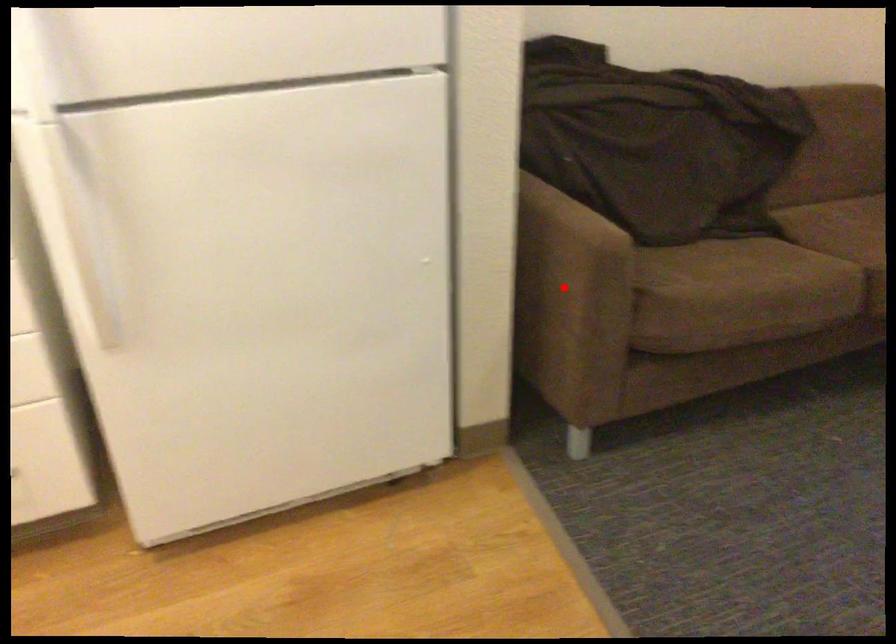
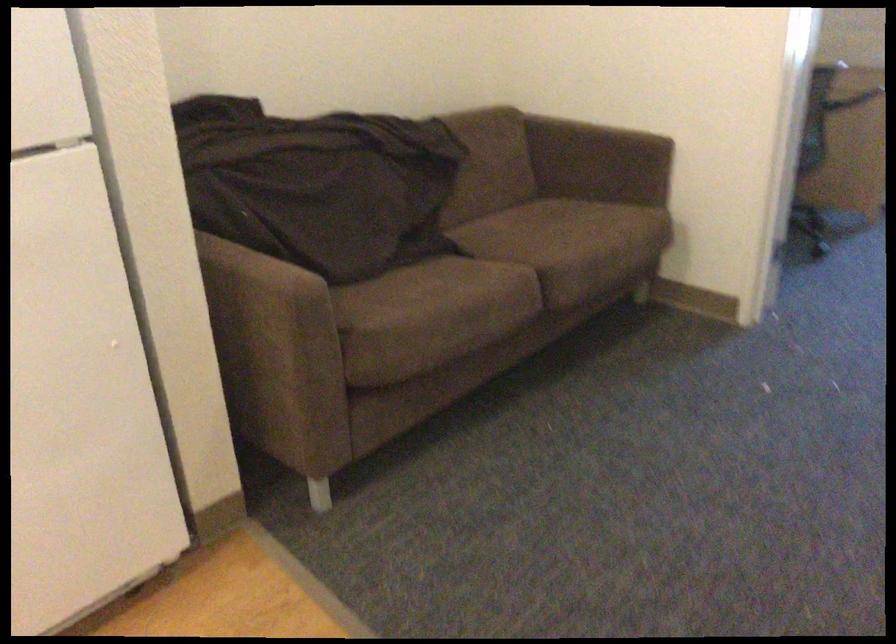
Question: I am providing you with two images of the same scene from different viewpoints. A red point is marked on the first image. Is the red point's position out of view in image 2?

Choices:
 (A) Yes
 (B) No

Answer: (B)